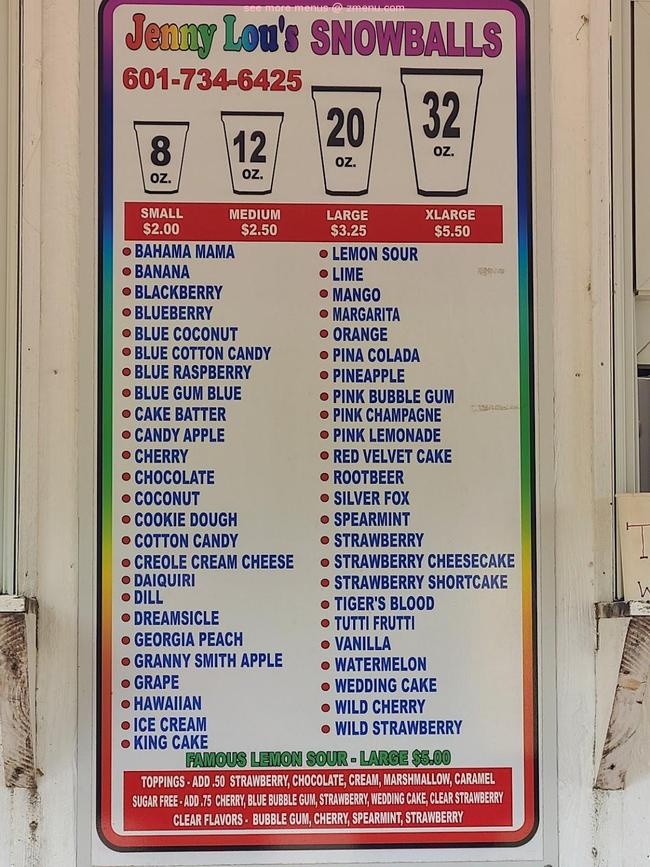
Find the location of a particular element. This screenshot has height=867, width=650. window sill is located at coordinates (636, 613), (14, 605).